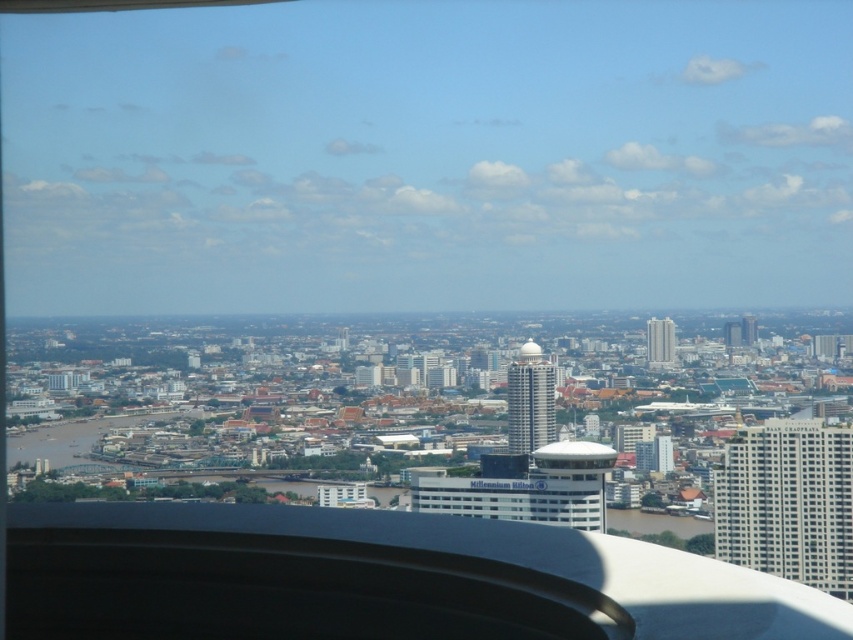
Is gray concrete tower at center above matte glass skyscraper at center-right?

Incorrect, gray concrete tower at center is not positioned above matte glass skyscraper at center-right.

Measure the distance between point [512,406] and camera.

Point [512,406] and camera are 2129.83 feet apart from each other.

What are the coordinates of `gray concrete tower at center` in the screenshot? It's located at (531, 401).

Does point (419, 508) come behind point (728, 333)?

No, it is in front of (728, 333).

Is white glass building at center taller than matte glass skyscraper at center-right?

Correct, white glass building at center is much taller as matte glass skyscraper at center-right.

Identify the location of white glass building at center. (515, 502).

Which is behind, point (519, 374) or point (747, 330)?

The point (747, 330) is behind.

Can you confirm if gray concrete tower at center is positioned to the right of matte gray skyscraper at right?

Incorrect, gray concrete tower at center is not on the right side of matte gray skyscraper at right.

I want to click on gray concrete tower at center, so click(x=531, y=401).